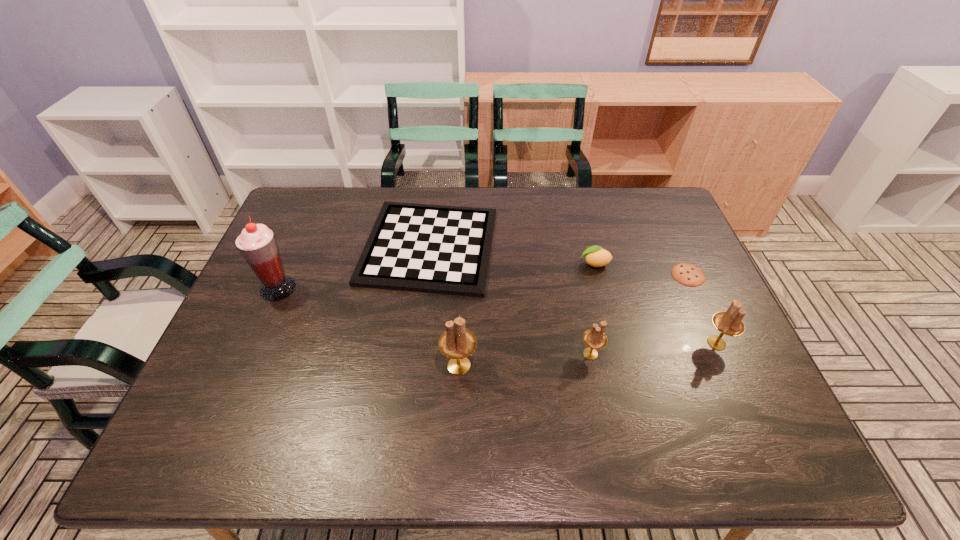
Locate an element on the screen. Image resolution: width=960 pixels, height=540 pixels. vacant space that satisfies the following two spatial constraints: 1. on the back side of the smoothie; 2. on the right side of the cookie is located at coordinates (284, 275).

The height and width of the screenshot is (540, 960). What are the coordinates of `vacant space that satisfies the following two spatial constraints: 1. with leaves positioned above the shortest object; 2. on the right side of the lemon` in the screenshot? It's located at (597, 275).

Where is `free space in the image that satisfies the following two spatial constraints: 1. on the front side of the sixth tallest object; 2. on the right side of the shortest object`? This screenshot has height=540, width=960. free space in the image that satisfies the following two spatial constraints: 1. on the front side of the sixth tallest object; 2. on the right side of the shortest object is located at coordinates (426, 275).